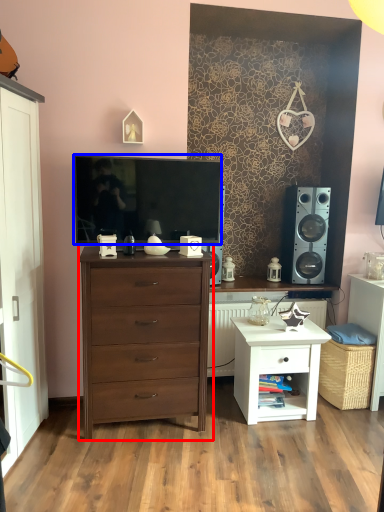
Question: Which of the following is the closest to the observer, chest of drawers (highlighted by a red box) or television (highlighted by a blue box)?

Choices:
 (A) chest of drawers
 (B) television

Answer: (A)